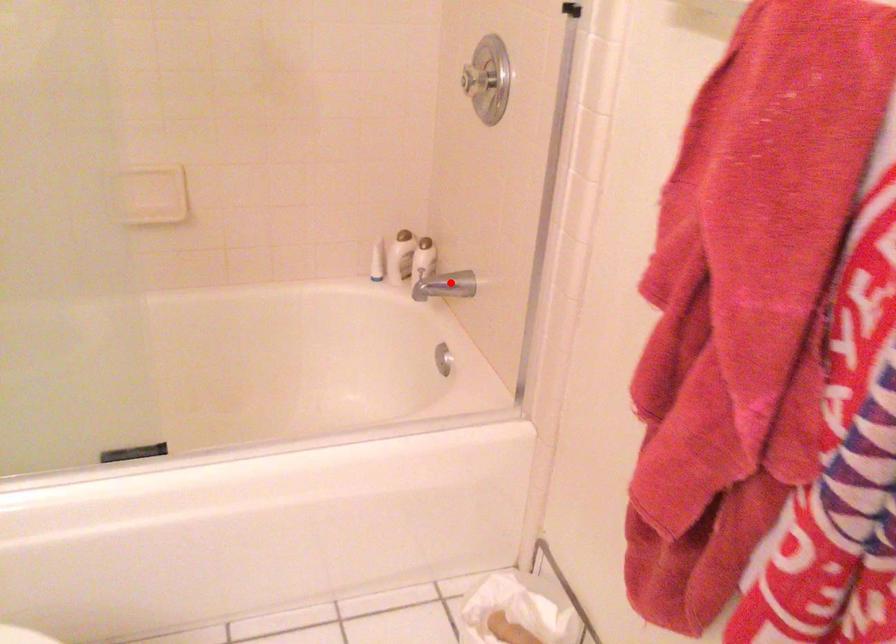
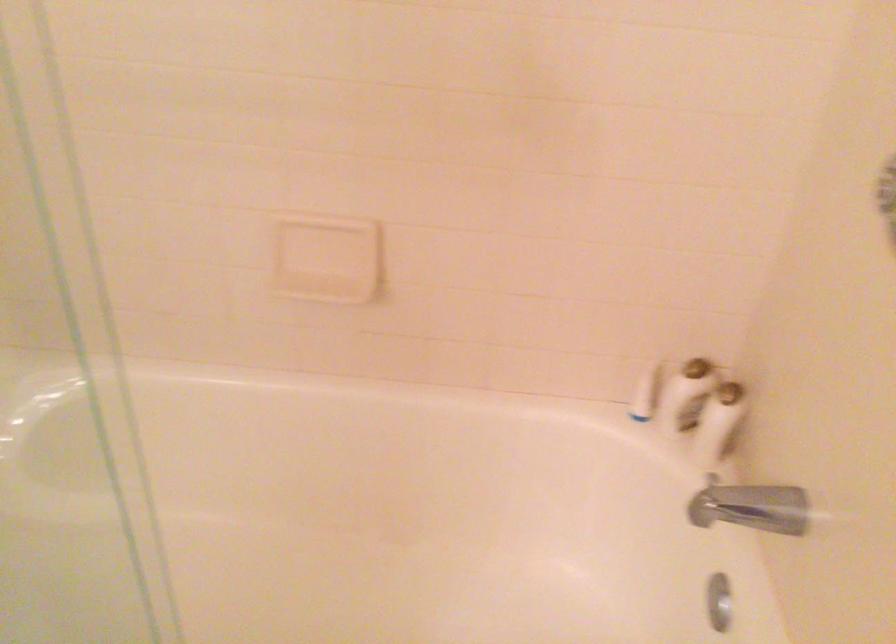
Question: I am providing you with two images of the same scene from different viewpoints. Image1 has a red point marked. In image2, the corresponding 3D location appears at what relative position? Reply with the corresponding letter.

Choices:
 (A) Closer
 (B) Farther

Answer: (A)